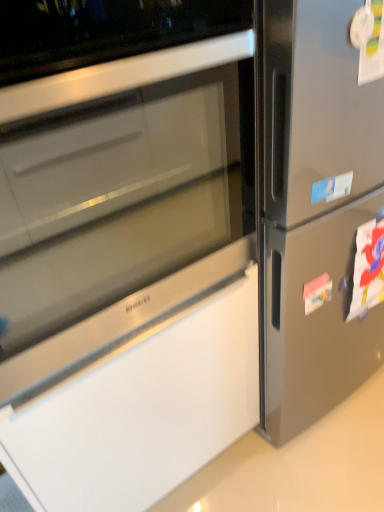
Question: Is blue paper sticker at upper right, which is the 1th sticker from front to back, turned away from pink matte paper at right, positioned as the first sticker in bottom-to-top order?

Choices:
 (A) yes
 (B) no

Answer: (B)

Question: Is blue paper sticker at upper right, which is the 1th sticker from front to back, wider than pink matte paper at right, the second sticker positioned from the front?

Choices:
 (A) no
 (B) yes

Answer: (A)

Question: Considering the relative sizes of blue paper sticker at upper right, the 2th sticker viewed from the back, and pink matte paper at right, which appears as the 1th sticker when viewed from the back, in the image provided, is blue paper sticker at upper right, the 2th sticker viewed from the back, smaller than pink matte paper at right, which appears as the 1th sticker when viewed from the back,?

Choices:
 (A) yes
 (B) no

Answer: (A)

Question: Is pink matte paper at right, positioned as the first sticker in bottom-to-top order, completely or partially inside blue paper sticker at upper right, positioned as the 2th sticker in bottom-to-top order?

Choices:
 (A) yes
 (B) no

Answer: (B)

Question: Is blue paper sticker at upper right, which appears as the first sticker when viewed from the top, located outside pink matte paper at right, which appears as the 1th sticker when viewed from the back?

Choices:
 (A) yes
 (B) no

Answer: (A)

Question: Does blue paper sticker at upper right, positioned as the 2th sticker in bottom-to-top order, come in front of pink matte paper at right, positioned as the second sticker in top-to-bottom order?

Choices:
 (A) yes
 (B) no

Answer: (A)

Question: Is pink matte paper at right, the second sticker positioned from the front, far away from blue paper sticker at upper right, which is the 1th sticker from front to back?

Choices:
 (A) yes
 (B) no

Answer: (B)

Question: Does pink matte paper at right, which appears as the 1th sticker when viewed from the back, come behind blue paper sticker at upper right, which appears as the first sticker when viewed from the top?

Choices:
 (A) yes
 (B) no

Answer: (A)

Question: Is pink matte paper at right, positioned as the second sticker in top-to-bottom order, looking in the opposite direction of blue paper sticker at upper right, positioned as the 2th sticker in bottom-to-top order?

Choices:
 (A) yes
 (B) no

Answer: (B)

Question: Considering the relative sizes of pink matte paper at right, the second sticker positioned from the front, and blue paper sticker at upper right, which appears as the first sticker when viewed from the top, in the image provided, is pink matte paper at right, the second sticker positioned from the front, bigger than blue paper sticker at upper right, which appears as the first sticker when viewed from the top,?

Choices:
 (A) no
 (B) yes

Answer: (B)

Question: Is pink matte paper at right, which appears as the 1th sticker when viewed from the back, beside blue paper sticker at upper right, positioned as the 2th sticker in bottom-to-top order?

Choices:
 (A) no
 (B) yes

Answer: (A)

Question: Can we say pink matte paper at right, positioned as the second sticker in top-to-bottom order, lies outside blue paper sticker at upper right, which is the 1th sticker from front to back?

Choices:
 (A) no
 (B) yes

Answer: (B)

Question: In the image, is pink matte paper at right, positioned as the first sticker in bottom-to-top order, positioned in front of or behind blue paper sticker at upper right, positioned as the 2th sticker in bottom-to-top order?

Choices:
 (A) behind
 (B) front

Answer: (A)